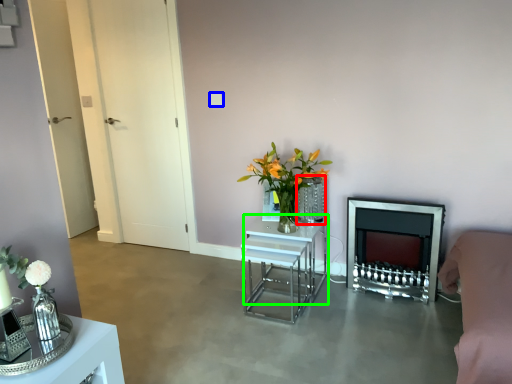
Question: Which is nearer to the vase (highlighted by a red box)? square (highlighted by a blue box) or table (highlighted by a green box).

Choices:
 (A) square
 (B) table

Answer: (B)